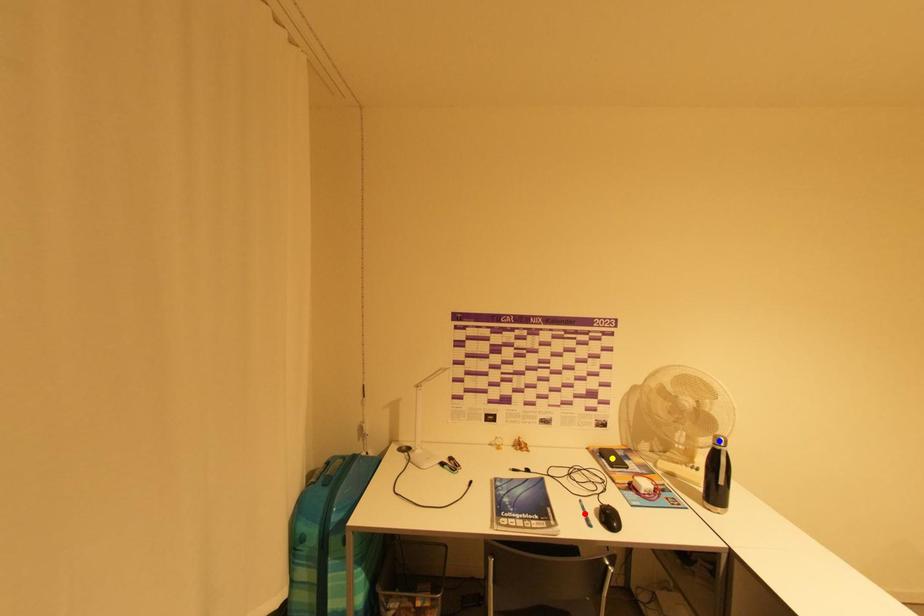
Order these from nearest to farthest:
1. yellow point
2. blue point
3. red point

blue point
red point
yellow point